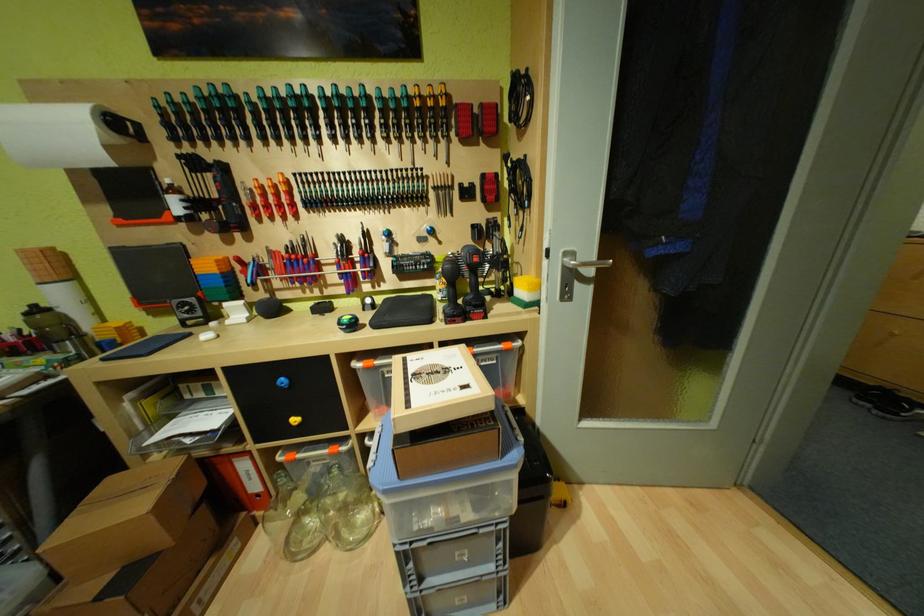
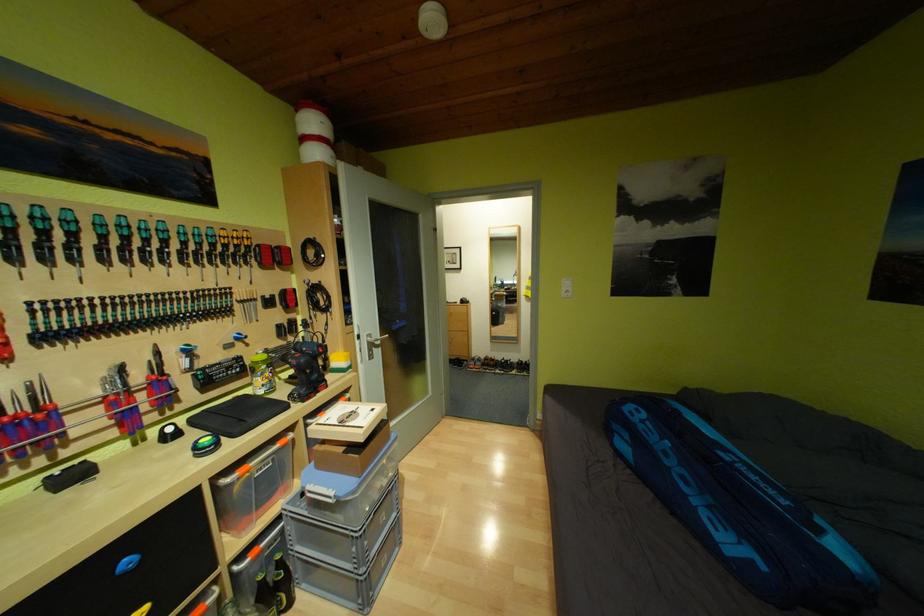
The point at (292, 382) is marked in the first image. Where is the corresponding point in the second image?

(136, 562)